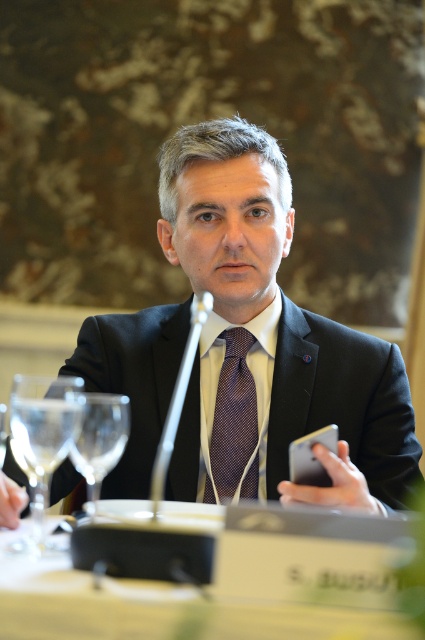
Is transparent glass at left wider than clear glass wine glass at left?

Correct, the width of transparent glass at left exceeds that of clear glass wine glass at left.

Is the position of transparent glass at left less distant than that of clear glass wine glass at left?

Yes, it is.

Between point (62, 442) and point (112, 460), which one is positioned in front?

Point (62, 442) is in front.

Where is `transparent glass at left`? The width and height of the screenshot is (425, 640). transparent glass at left is located at coordinates (42, 440).

Which of these two, white plastic table at center or clear glass wine glass at left, stands taller?

With more height is clear glass wine glass at left.

Does white plastic table at center come behind clear glass wine glass at left?

No, white plastic table at center is closer to the viewer.

Locate an element on the screen. The image size is (425, 640). white plastic table at center is located at coordinates (210, 595).

Is matte black suit at center positioned at the back of clear glass wine glass at left?

Yes, it is behind clear glass wine glass at left.

Is matte black suit at center thinner than clear glass wine glass at left?

In fact, matte black suit at center might be wider than clear glass wine glass at left.

Is point (130, 337) farther from viewer compared to point (105, 438)?

That is True.

You are a GUI agent. You are given a task and a screenshot of the screen. Output one action in this format:
    pyautogui.click(x=<x>, y=<y>)
    Task: Click on the matte black suit at center
    
    Given the screenshot: What is the action you would take?
    pyautogui.click(x=271, y=339)